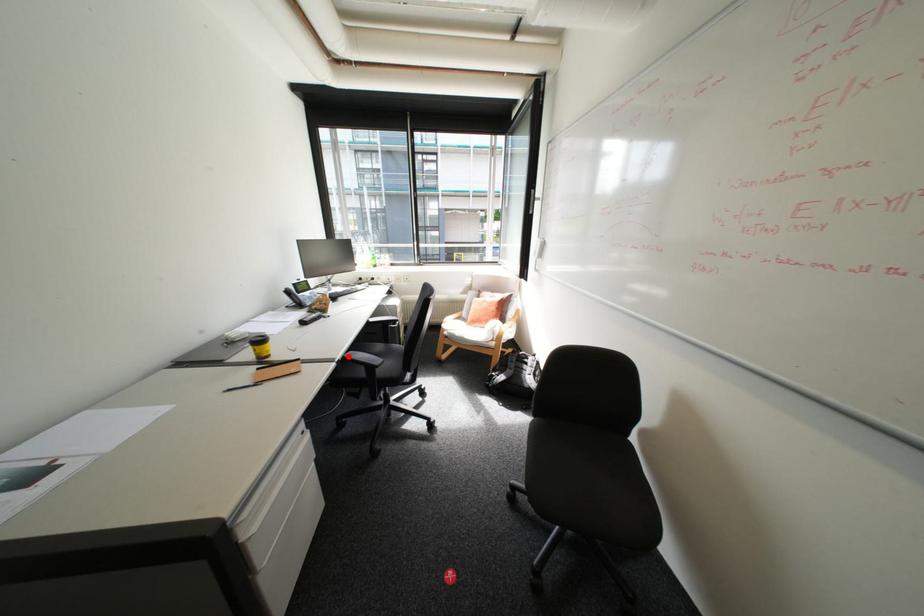
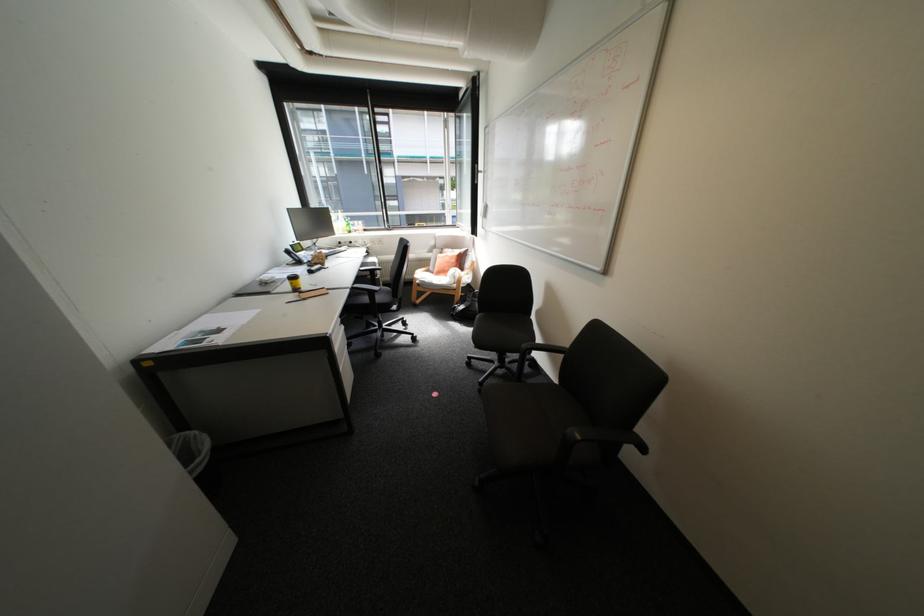
Where in the second image is the point corresponding to the highlighted location from the first image?

(359, 286)